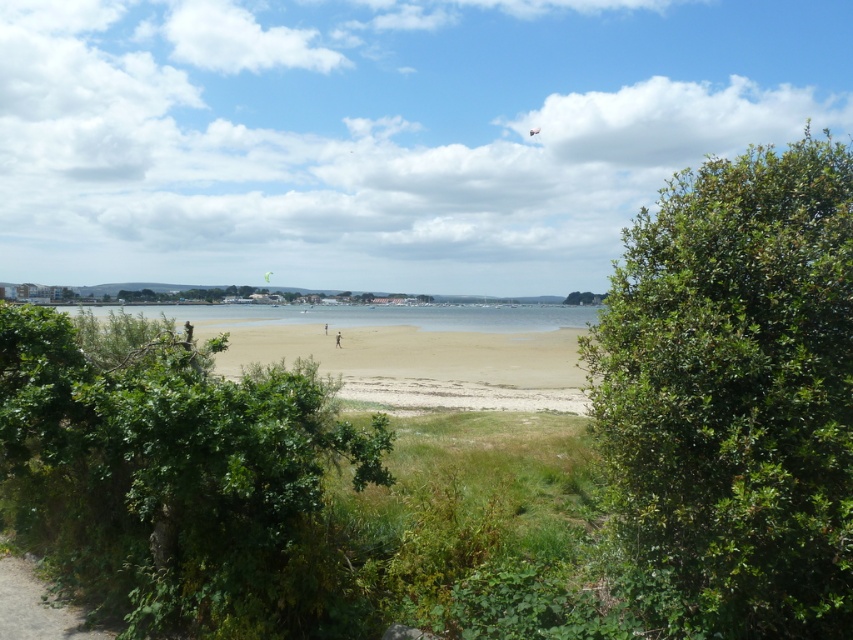
Question: Does green leafy bush at lower left appear under light brown sand at center?

Choices:
 (A) yes
 (B) no

Answer: (B)

Question: Can you confirm if green leafy bush at right is smaller than clear water at center?

Choices:
 (A) no
 (B) yes

Answer: (A)

Question: Which of the following is the closest to the observer?

Choices:
 (A) green leafy bush at lower left
 (B) clear water at center
 (C) brown sand at center
 (D) light brown sand at center

Answer: (A)

Question: Among these points, which one is farthest from the camera?

Choices:
 (A) (329, 352)
 (B) (595, 372)
 (C) (328, 596)

Answer: (A)

Question: Based on their relative distances, which object is nearer to the green leafy bush at right?

Choices:
 (A) clear water at center
 (B) light brown sand at center
 (C) green leafy bush at lower left
 (D) brown sand at center

Answer: (C)

Question: Considering the relative positions of green leafy bush at lower left and clear water at center in the image provided, where is green leafy bush at lower left located with respect to clear water at center?

Choices:
 (A) above
 (B) below

Answer: (B)